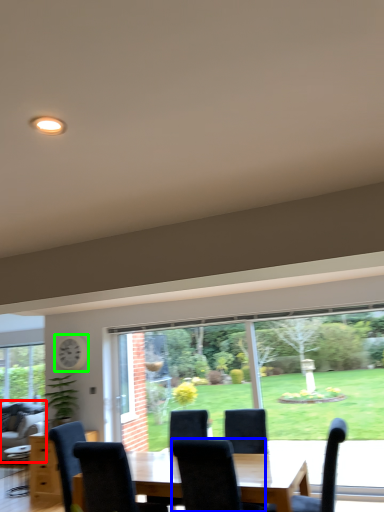
Question: Estimate the real-world distances between objects in this image. Which object is farther from couch (highlighted by a red box), chair (highlighted by a blue box) or clock (highlighted by a green box)?

Choices:
 (A) chair
 (B) clock

Answer: (A)